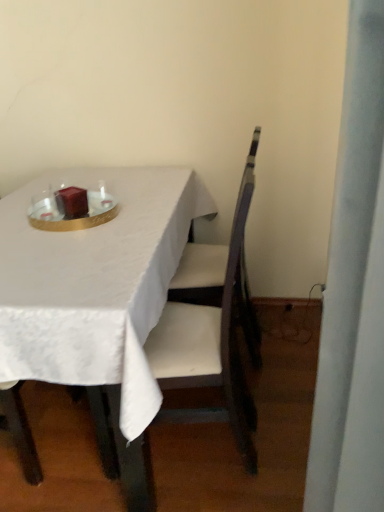
Question: Is white fabric table at center next to shiny gold tray at center and touching it?

Choices:
 (A) no
 (B) yes

Answer: (A)

Question: Would you say white fabric table at center is outside shiny gold tray at center?

Choices:
 (A) no
 (B) yes

Answer: (B)

Question: From the image's perspective, is white fabric table at center over shiny gold tray at center?

Choices:
 (A) no
 (B) yes

Answer: (A)

Question: Does white fabric table at center appear on the right side of shiny gold tray at center?

Choices:
 (A) yes
 (B) no

Answer: (A)

Question: From a real-world perspective, is white fabric table at center positioned under shiny gold tray at center based on gravity?

Choices:
 (A) yes
 (B) no

Answer: (A)

Question: From a real-world perspective, is white fabric table at center physically above shiny gold tray at center?

Choices:
 (A) no
 (B) yes

Answer: (A)

Question: Can you confirm if shiny gold tray at center is wider than white fabric table at center?

Choices:
 (A) yes
 (B) no

Answer: (B)

Question: Can you see shiny gold tray at center touching white fabric table at center?

Choices:
 (A) no
 (B) yes

Answer: (A)

Question: Is shiny gold tray at center completely or partially outside of white fabric table at center?

Choices:
 (A) yes
 (B) no

Answer: (B)

Question: Does shiny gold tray at center have a smaller size compared to white fabric table at center?

Choices:
 (A) yes
 (B) no

Answer: (A)

Question: Does shiny gold tray at center have a lesser width compared to white fabric table at center?

Choices:
 (A) yes
 (B) no

Answer: (A)

Question: Is shiny gold tray at center further to the viewer compared to white fabric table at center?

Choices:
 (A) no
 (B) yes

Answer: (B)

Question: Is wooden chair at center outside of white fabric table at center?

Choices:
 (A) yes
 (B) no

Answer: (B)